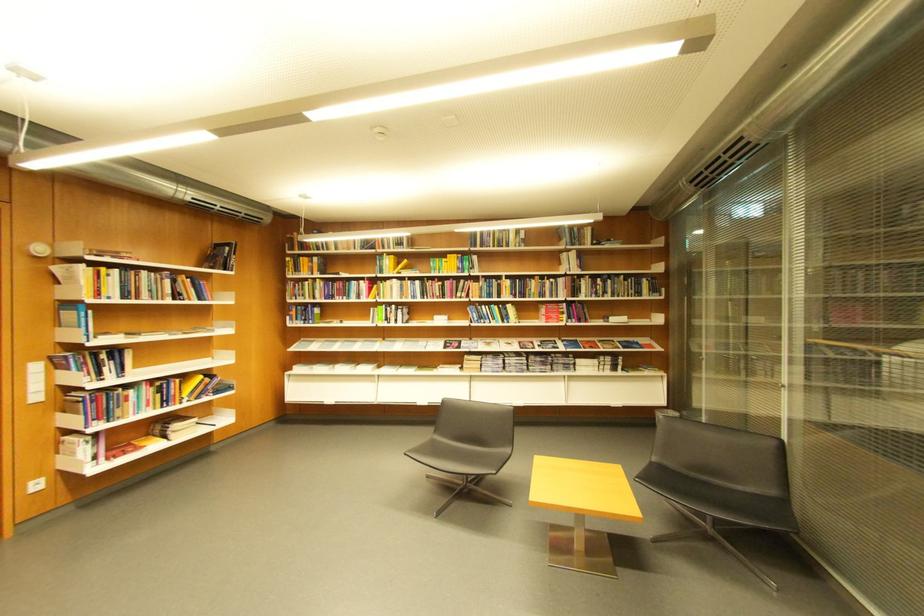
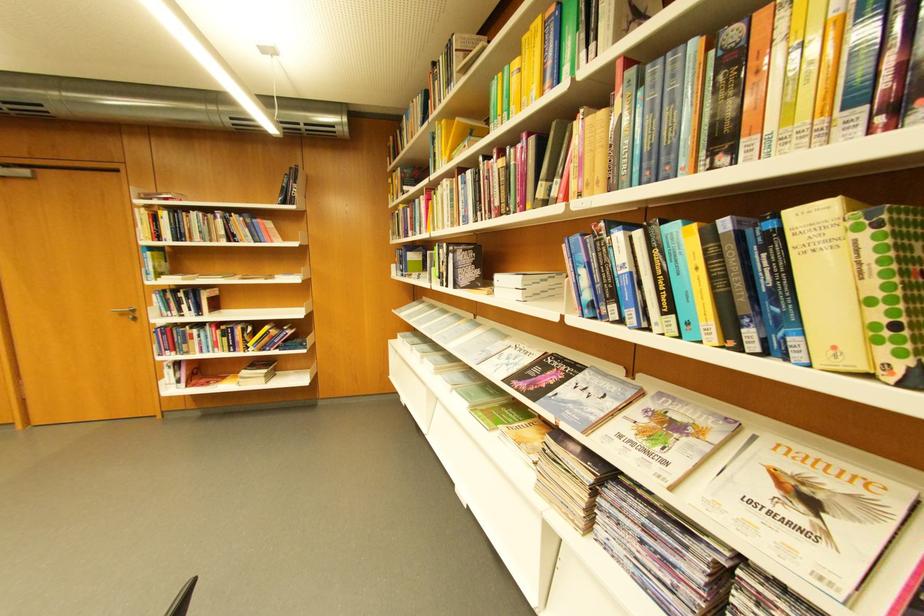
Where in the second image is the point corresponding to [456,349] from the first image?

(532, 377)